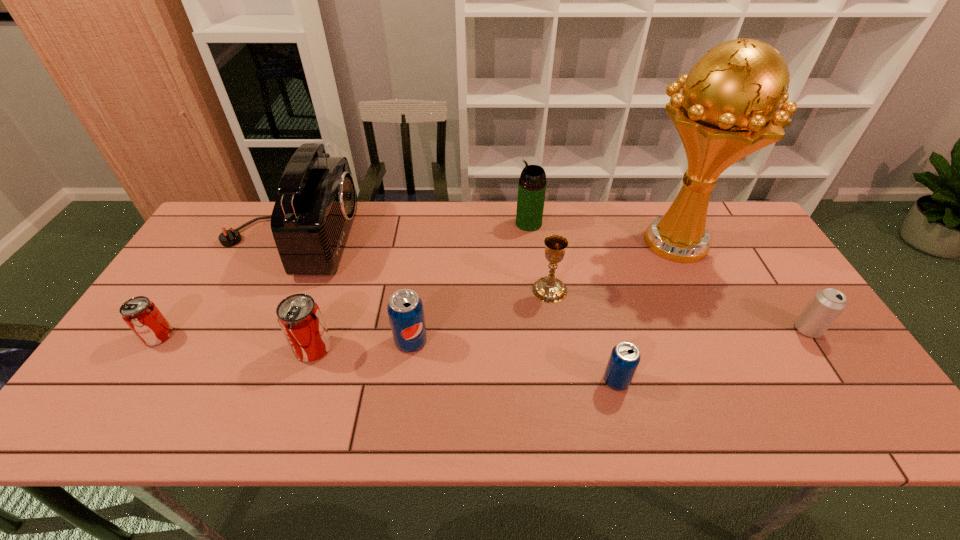
This screenshot has width=960, height=540. What are the coordinates of `trophy_cup` in the screenshot? It's located at (727, 109).

This screenshot has width=960, height=540. What are the coordinates of `the second object from right to left` in the screenshot? It's located at (727, 109).

This screenshot has width=960, height=540. Find the location of `the second tallest object`. the second tallest object is located at coordinates (313, 214).

The height and width of the screenshot is (540, 960). Find the location of `green thermos bottle`. green thermos bottle is located at coordinates (532, 184).

Find the location of a particular element. the third tallest object is located at coordinates (532, 184).

This screenshot has height=540, width=960. What are the coordinates of `chalice` in the screenshot? It's located at (549, 289).

This screenshot has height=540, width=960. Identify the location of the second pop soda from right to left. (405, 310).

Locate an element on the screen. the left blue pop soda is located at coordinates (405, 310).

At what (x,y) coordinates should I click in order to perform the action: click on the right red pop soda. Please return your answer as a coordinate pair (x, y). This screenshot has height=540, width=960. Looking at the image, I should click on (299, 317).

I want to click on the bigger red pop soda, so click(299, 317).